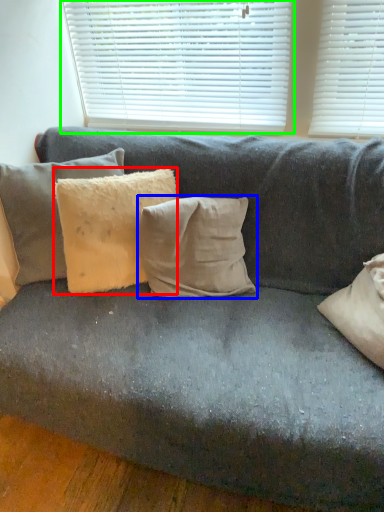
Question: Estimate the real-world distances between objects in this image. Which object is closer to pillow (highlighted by a red box), pillow (highlighted by a blue box) or window blind (highlighted by a green box)?

Choices:
 (A) pillow
 (B) window blind

Answer: (A)